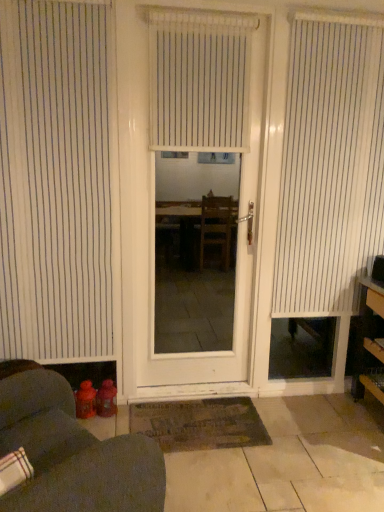
Question: Should I look upward or downward to see wooden shelves at right?

Choices:
 (A) down
 (B) up

Answer: (A)

Question: Is white matte door at center in front of dark brown textured mat at center?

Choices:
 (A) no
 (B) yes

Answer: (B)

Question: Is white matte door at center facing away from dark brown textured mat at center?

Choices:
 (A) yes
 (B) no

Answer: (B)

Question: Is white matte door at center not near dark brown textured mat at center?

Choices:
 (A) no
 (B) yes

Answer: (B)

Question: Would you say white matte door at center is outside dark brown textured mat at center?

Choices:
 (A) yes
 (B) no

Answer: (A)

Question: Can you confirm if white matte door at center is positioned to the left of dark brown textured mat at center?

Choices:
 (A) no
 (B) yes

Answer: (A)

Question: From a real-world perspective, does white matte door at center sit lower than dark brown textured mat at center?

Choices:
 (A) yes
 (B) no

Answer: (B)

Question: Is white striped blind at lower left, arranged as the third window blind when viewed from the right, not near dark brown textured mat at center?

Choices:
 (A) no
 (B) yes

Answer: (B)

Question: Could you tell me if white striped blind at lower left, the 1th window blind when ordered from left to right, is facing dark brown textured mat at center?

Choices:
 (A) yes
 (B) no

Answer: (B)

Question: Is white striped blind at lower left, the 1th window blind when ordered from left to right, surrounding dark brown textured mat at center?

Choices:
 (A) yes
 (B) no

Answer: (B)

Question: Can you confirm if white striped blind at lower left, arranged as the third window blind when viewed from the right, is thinner than dark brown textured mat at center?

Choices:
 (A) no
 (B) yes

Answer: (B)

Question: From the image's perspective, is white striped blind at lower left, the 1th window blind when ordered from left to right, above dark brown textured mat at center?

Choices:
 (A) no
 (B) yes

Answer: (B)

Question: From a real-world perspective, is white striped blind at lower left, the 1th window blind when ordered from left to right, under dark brown textured mat at center?

Choices:
 (A) yes
 (B) no

Answer: (B)

Question: From a real-world perspective, is dark brown textured mat at center over white vertical blinds at center, which ranks as the second window blind in left-to-right order?

Choices:
 (A) no
 (B) yes

Answer: (A)